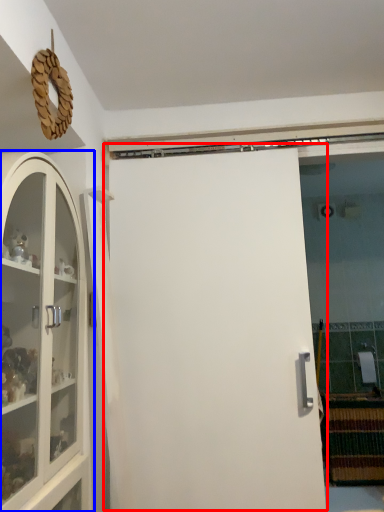
Question: Which point is closer to the camera, door (highlighted by a red box) or cabinetry (highlighted by a blue box)?

Choices:
 (A) door
 (B) cabinetry

Answer: (B)